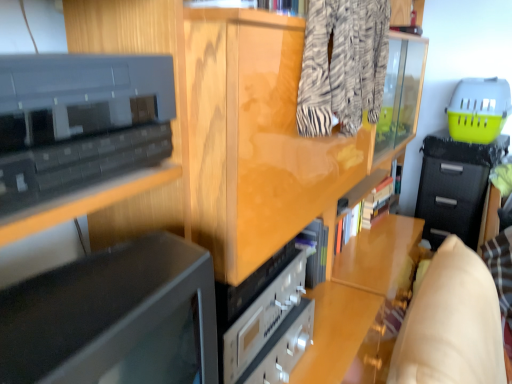
Question: From a real-world perspective, relative to black fabric drawer at right, is zebra-patterned fabric at upper center vertically above or below?

Choices:
 (A) above
 (B) below

Answer: (A)

Question: Considering the positions of zebra-patterned fabric at upper center and black fabric drawer at right in the image, is zebra-patterned fabric at upper center taller or shorter than black fabric drawer at right?

Choices:
 (A) tall
 (B) short

Answer: (B)

Question: Estimate the real-world distances between objects in this image. Which object is farther from the black glossy cabinet at upper left?

Choices:
 (A) black fabric drawer at right
 (B) zebra-patterned fabric at upper center

Answer: (A)

Question: Which of these objects is positioned closest to the black glossy cabinet at upper left?

Choices:
 (A) zebra-patterned fabric at upper center
 (B) black fabric drawer at right

Answer: (A)